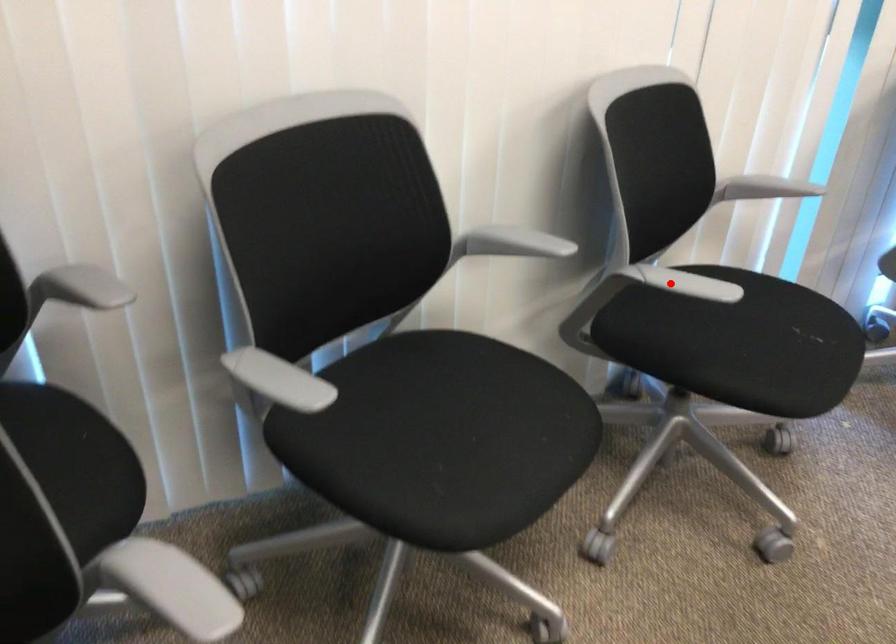
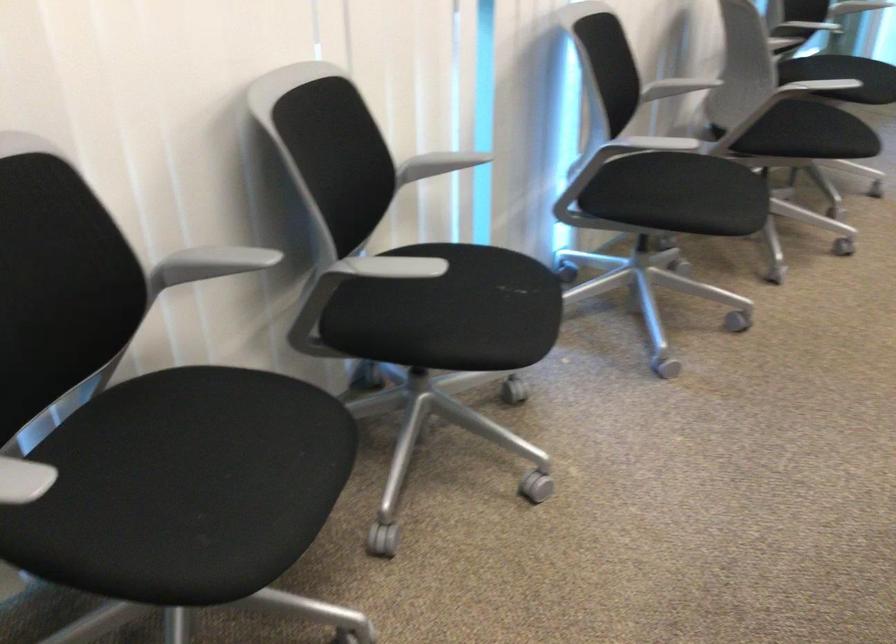
Find the pixel in the second image that matches the highlighted location in the first image.

(384, 267)